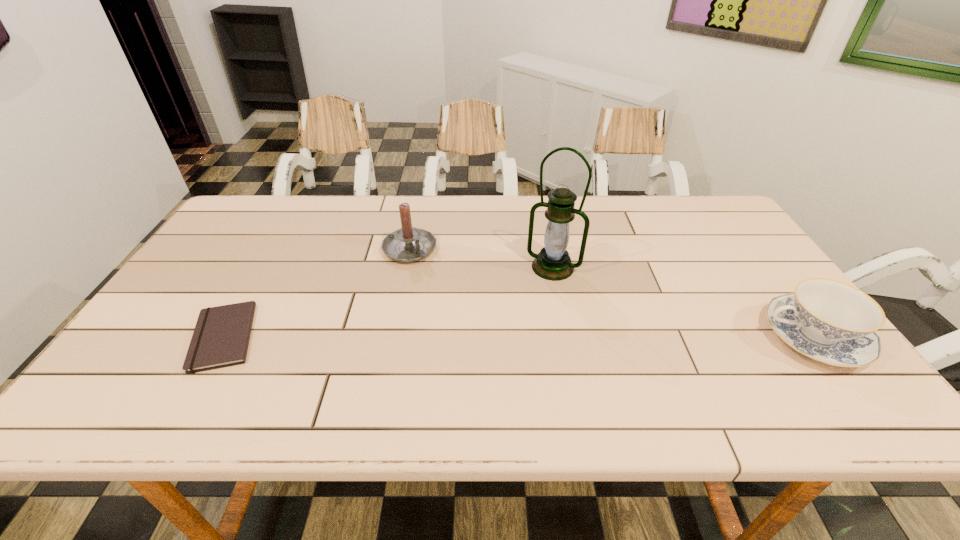
Find the location of a particular element. chinaware that is at the near edge is located at coordinates (829, 321).

This screenshot has height=540, width=960. I want to click on object that is at the left edge, so click(x=221, y=336).

Locate an element on the screen. object that is at the right edge is located at coordinates (829, 321).

Where is `object that is at the near left corner`? The width and height of the screenshot is (960, 540). object that is at the near left corner is located at coordinates (221, 336).

The height and width of the screenshot is (540, 960). Identify the location of object situated at the near right corner. (829, 321).

Where is `free location at the far edge`? Image resolution: width=960 pixels, height=540 pixels. free location at the far edge is located at coordinates (616, 200).

Identify the location of vacant space at the near edge of the desktop. This screenshot has width=960, height=540. (596, 364).

In the image, there is a desktop. Where is `vacant space at the left edge`? This screenshot has width=960, height=540. vacant space at the left edge is located at coordinates (181, 301).

At what (x,y) coordinates should I click in order to perform the action: click on vacant area at the right edge. Please return your answer as a coordinate pair (x, y). The width and height of the screenshot is (960, 540). Looking at the image, I should click on (729, 253).

The height and width of the screenshot is (540, 960). I want to click on vacant space at the far left corner of the desktop, so click(275, 194).